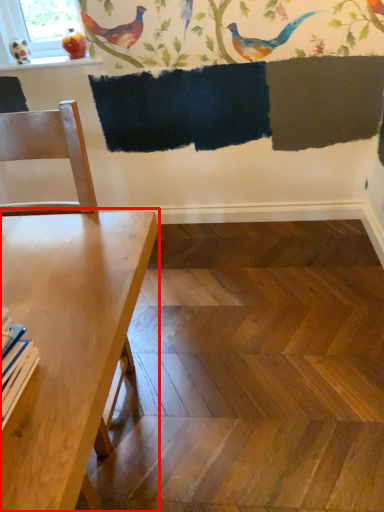
Question: Where is table (annotated by the red box) located in relation to bird in the image?

Choices:
 (A) left
 (B) right

Answer: (B)